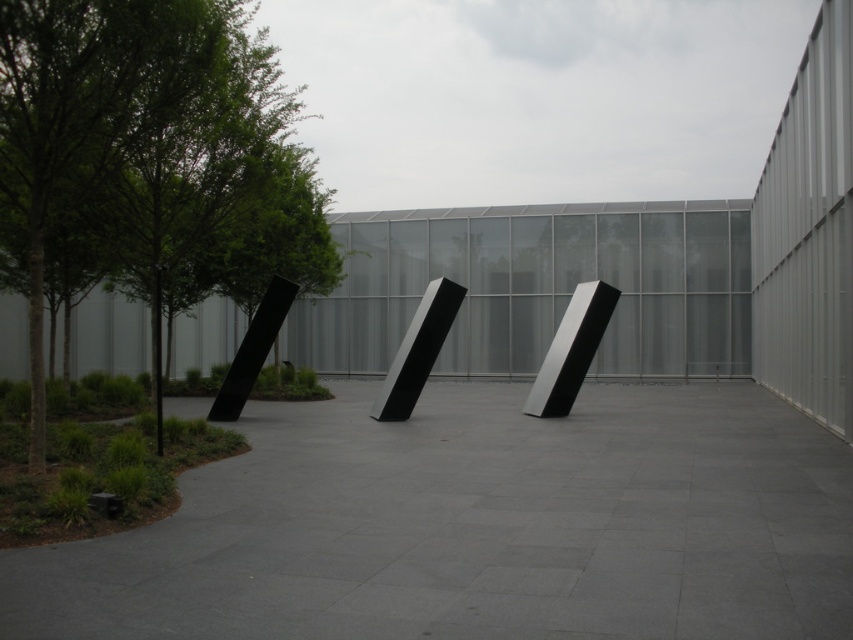
Question: Does gray concrete at center appear over green leafy tree at left?

Choices:
 (A) yes
 (B) no

Answer: (B)

Question: Can you confirm if gray concrete at center is positioned to the left of green leafy tree at left?

Choices:
 (A) no
 (B) yes

Answer: (A)

Question: From the image, what is the correct spatial relationship of gray concrete at center in relation to green leafy tree at left?

Choices:
 (A) right
 (B) left

Answer: (A)

Question: Which object is closer to the camera taking this photo?

Choices:
 (A) gray concrete at center
 (B) green leafy tree at left

Answer: (A)